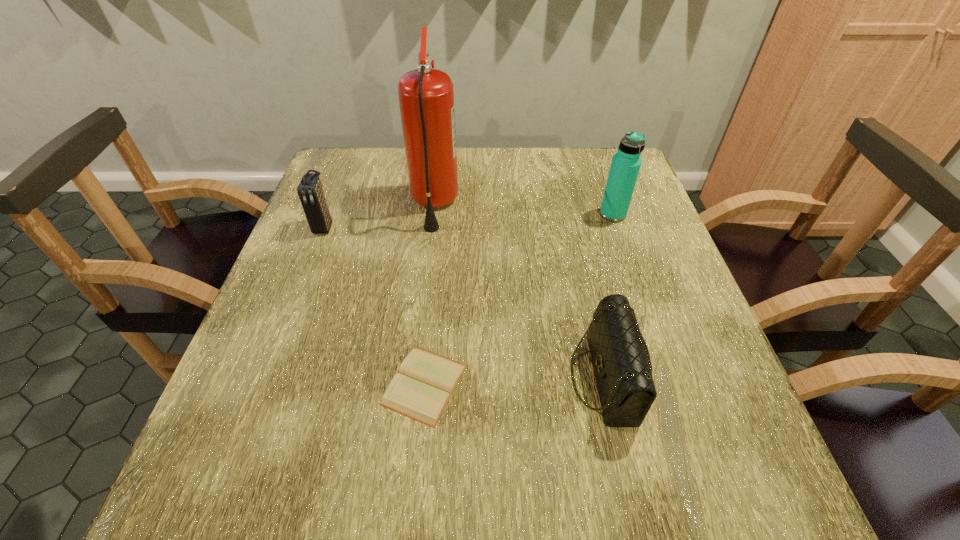
Locate an element on the screen. This screenshot has height=540, width=960. vacant space at the left edge of the desktop is located at coordinates (350, 237).

I want to click on free location at the right edge of the desktop, so click(701, 381).

Identify the location of vacant area at the near left corner of the desktop. The image size is (960, 540). (248, 463).

This screenshot has height=540, width=960. Find the location of `vacant area at the near right corner`. vacant area at the near right corner is located at coordinates (743, 503).

The image size is (960, 540). What are the coordinates of `vacant space that's between the water bottle and the leftmost object` in the screenshot? It's located at (468, 220).

Where is `free space between the leftmost object and the fire extinguisher`? free space between the leftmost object and the fire extinguisher is located at coordinates (379, 215).

Identify the location of vacant space that's between the nearer clutch bag and the taller clutch bag. (464, 302).

Where is `unoccupied area between the shorter clutch bag and the shortest object`? This screenshot has height=540, width=960. unoccupied area between the shorter clutch bag and the shortest object is located at coordinates (515, 381).

At what (x,y) coordinates should I click in order to perform the action: click on free space between the fire extinguisher and the left clutch bag. Please return your answer as a coordinate pair (x, y). This screenshot has width=960, height=540. Looking at the image, I should click on 379,215.

The height and width of the screenshot is (540, 960). I want to click on vacant area that lies between the farther clutch bag and the fourth shortest object, so click(x=468, y=220).